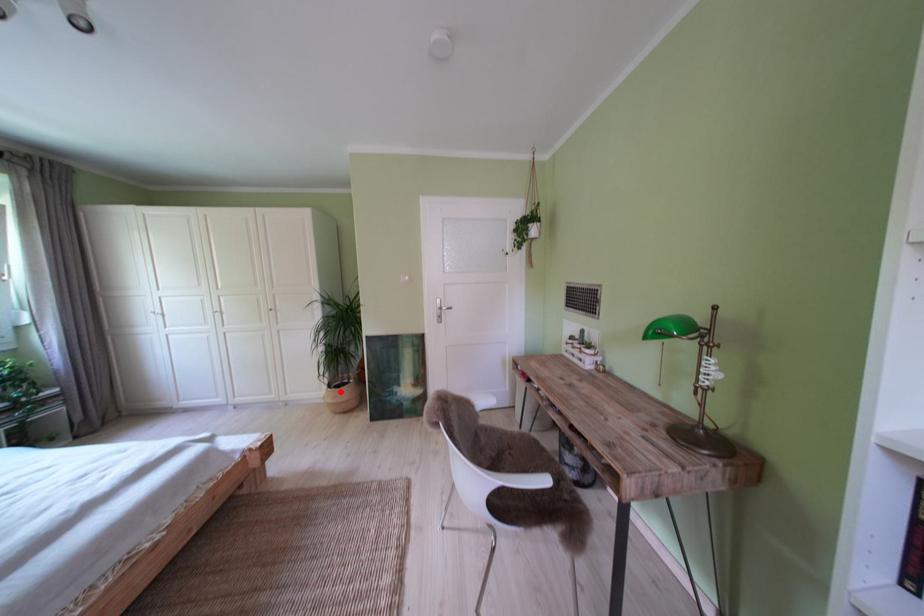
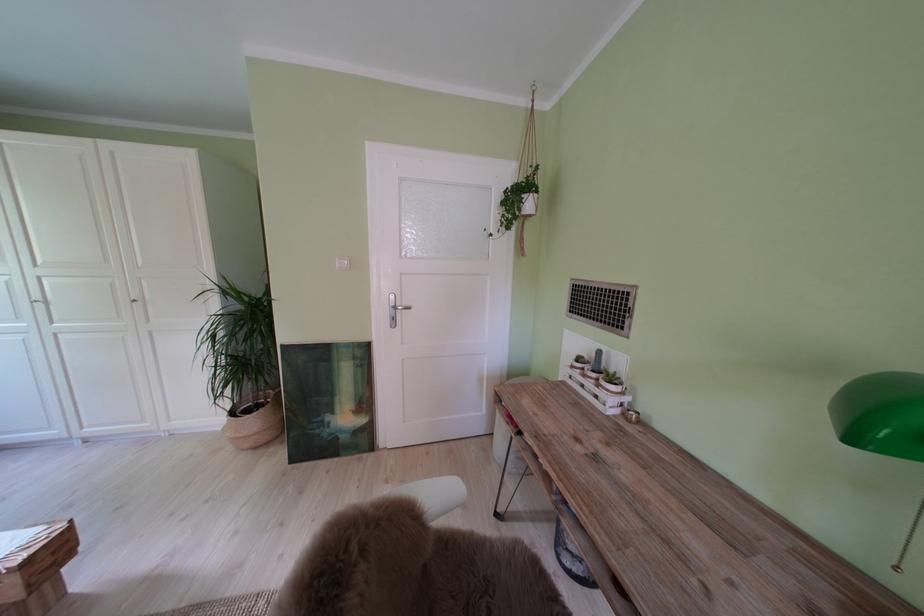
The point at the highlighted location is marked in the first image. Where is the corresponding point in the second image?

(242, 418)